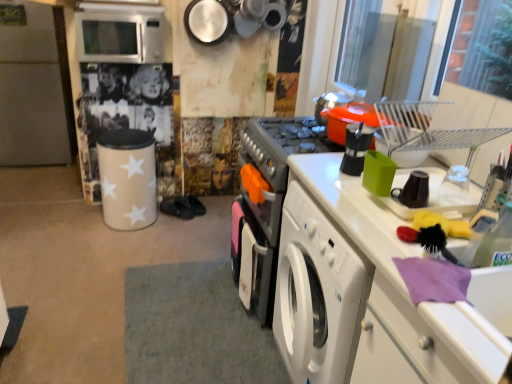
Question: Considering the relative positions of white matte refrigerator at left and satin silver microwave at upper left in the image provided, is white matte refrigerator at left to the left of satin silver microwave at upper left from the viewer's perspective?

Choices:
 (A) yes
 (B) no

Answer: (A)

Question: Is satin silver microwave at upper left located within white matte refrigerator at left?

Choices:
 (A) yes
 (B) no

Answer: (B)

Question: Is white matte refrigerator at left wider than satin silver microwave at upper left?

Choices:
 (A) no
 (B) yes

Answer: (B)

Question: Is white matte refrigerator at left not close to satin silver microwave at upper left?

Choices:
 (A) no
 (B) yes

Answer: (B)

Question: From the image's perspective, is white matte refrigerator at left above satin silver microwave at upper left?

Choices:
 (A) no
 (B) yes

Answer: (A)

Question: Could you tell me if white matte refrigerator at left is facing satin silver microwave at upper left?

Choices:
 (A) no
 (B) yes

Answer: (A)

Question: Considering the relative sizes of satin silver microwave at upper left and white matte refrigerator at left in the image provided, is satin silver microwave at upper left smaller than white matte refrigerator at left?

Choices:
 (A) no
 (B) yes

Answer: (A)

Question: From a real-world perspective, is satin silver microwave at upper left positioned under white matte refrigerator at left based on gravity?

Choices:
 (A) no
 (B) yes

Answer: (A)

Question: Can you confirm if satin silver microwave at upper left is positioned to the right of white matte refrigerator at left?

Choices:
 (A) no
 (B) yes

Answer: (B)

Question: Is the depth of satin silver microwave at upper left greater than that of white matte refrigerator at left?

Choices:
 (A) yes
 (B) no

Answer: (B)

Question: Is satin silver microwave at upper left shorter than white matte refrigerator at left?

Choices:
 (A) yes
 (B) no

Answer: (A)

Question: From the image's perspective, is satin silver microwave at upper left on top of white matte refrigerator at left?

Choices:
 (A) no
 (B) yes

Answer: (B)

Question: Is white matte refrigerator at left inside the boundaries of satin silver microwave at upper left, or outside?

Choices:
 (A) inside
 (B) outside

Answer: (B)